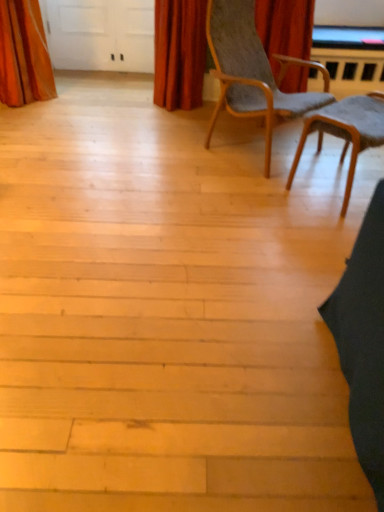
Question: Does orange velvet curtain at upper left, which appears as the 1th curtain when viewed from the left, appear on the right side of velvet red curtain at upper center, the 1th curtain when ordered from right to left?

Choices:
 (A) yes
 (B) no

Answer: (B)

Question: Are orange velvet curtain at upper left, which appears as the 1th curtain when viewed from the left, and velvet red curtain at upper center, the 1th curtain when ordered from right to left, making contact?

Choices:
 (A) no
 (B) yes

Answer: (A)

Question: Considering the relative positions of orange velvet curtain at upper left, the 2th curtain in the right-to-left sequence, and velvet red curtain at upper center, the 1th curtain when ordered from right to left, in the image provided, is orange velvet curtain at upper left, the 2th curtain in the right-to-left sequence, behind velvet red curtain at upper center, the 1th curtain when ordered from right to left,?

Choices:
 (A) no
 (B) yes

Answer: (A)

Question: Can you confirm if orange velvet curtain at upper left, which appears as the 1th curtain when viewed from the left, is smaller than velvet red curtain at upper center, the 1th curtain when ordered from right to left?

Choices:
 (A) yes
 (B) no

Answer: (B)

Question: Does orange velvet curtain at upper left, the 2th curtain in the right-to-left sequence, turn towards velvet red curtain at upper center, the 2th curtain from the left?

Choices:
 (A) no
 (B) yes

Answer: (A)

Question: In terms of height, does velvet red curtain at upper center, the 1th curtain when ordered from right to left, look taller or shorter compared to wooden textured chair at center right, the second chair from the left?

Choices:
 (A) tall
 (B) short

Answer: (A)

Question: Does point (162, 31) appear closer or farther from the camera than point (375, 122)?

Choices:
 (A) farther
 (B) closer

Answer: (A)

Question: Looking at the image, does velvet red curtain at upper center, the 2th curtain from the left, seem bigger or smaller compared to wooden textured chair at center right, the second chair from the left?

Choices:
 (A) small
 (B) big

Answer: (A)

Question: From a real-world perspective, is velvet red curtain at upper center, the 1th curtain when ordered from right to left, above or below wooden textured chair at center right, which is the 1th chair from right to left?

Choices:
 (A) above
 (B) below

Answer: (A)

Question: Would you say light brown wood chair at center, the 2th chair positioned from the right, is to the left or to the right of velvet red curtain at upper center, the 1th curtain when ordered from right to left, in the picture?

Choices:
 (A) right
 (B) left

Answer: (A)

Question: Do you think light brown wood chair at center, marked as the first chair in a left-to-right arrangement, is within velvet red curtain at upper center, the 2th curtain from the left, or outside of it?

Choices:
 (A) inside
 (B) outside

Answer: (B)

Question: Considering the positions of light brown wood chair at center, the 2th chair positioned from the right, and velvet red curtain at upper center, the 1th curtain when ordered from right to left, in the image, is light brown wood chair at center, the 2th chair positioned from the right, taller or shorter than velvet red curtain at upper center, the 1th curtain when ordered from right to left,?

Choices:
 (A) tall
 (B) short

Answer: (A)

Question: Considering their positions, is light brown wood chair at center, marked as the first chair in a left-to-right arrangement, located in front of or behind velvet red curtain at upper center, the 1th curtain when ordered from right to left?

Choices:
 (A) behind
 (B) front

Answer: (B)

Question: Does point (231, 94) appear closer or farther from the camera than point (44, 84)?

Choices:
 (A) closer
 (B) farther

Answer: (A)

Question: Is light brown wood chair at center, the 2th chair positioned from the right, in front of or behind orange velvet curtain at upper left, which appears as the 1th curtain when viewed from the left, in the image?

Choices:
 (A) behind
 (B) front

Answer: (B)